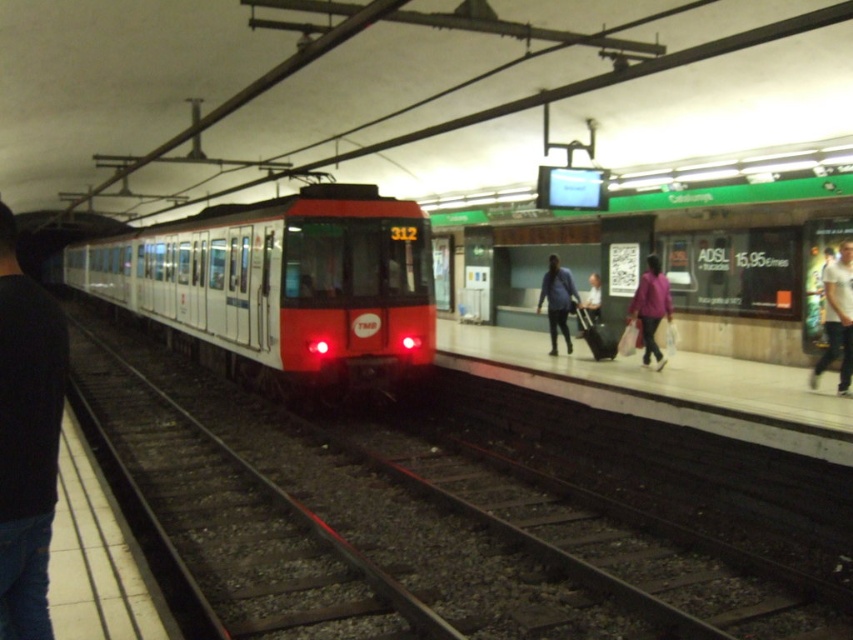
Is black fabric at left positioned in front of blue denim jacket at center?

That is True.

Which is behind, point (24, 426) or point (552, 349)?

Positioned behind is point (552, 349).

The height and width of the screenshot is (640, 853). In order to click on black fabric at left in this screenshot , I will do `click(26, 438)`.

Does purple fabric jacket at right appear on the left side of blue denim jacket at center?

Incorrect, purple fabric jacket at right is not on the left side of blue denim jacket at center.

Can you confirm if purple fabric jacket at right is taller than blue denim jacket at center?

Yes, purple fabric jacket at right is taller than blue denim jacket at center.

Locate an element on the screen. The width and height of the screenshot is (853, 640). purple fabric jacket at right is located at coordinates (650, 308).

In order to click on purple fabric jacket at right in this screenshot , I will do `click(650, 308)`.

Which is below, white cotton shirt at right or white cotton shirt at center?

white cotton shirt at right

Does white cotton shirt at right have a lesser width compared to white cotton shirt at center?

Incorrect, white cotton shirt at right's width is not less than white cotton shirt at center's.

Is point (840, 349) closer to viewer compared to point (590, 282)?

Yes, point (840, 349) is closer to viewer.

Image resolution: width=853 pixels, height=640 pixels. In order to click on white cotton shirt at right in this screenshot , I will do `click(837, 317)`.